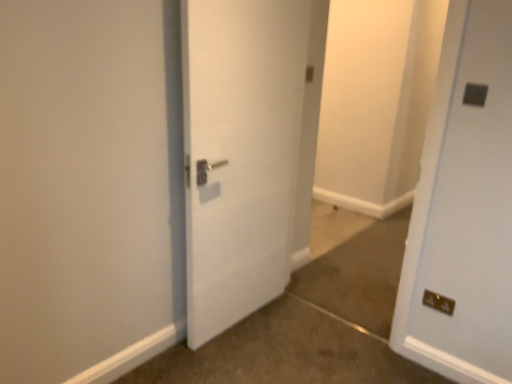
Measure the distance between point (174, 358) and camera.

Point (174, 358) and camera are 2.20 meters apart from each other.

The width and height of the screenshot is (512, 384). Find the location of `dark gray plastic electric outlet at upper right, which is the first electric outlet from top to bottom`. dark gray plastic electric outlet at upper right, which is the first electric outlet from top to bottom is located at coordinates coord(475,94).

In order to face metallic gold electrical outlet at lower right, which is the 2th electric outlet in front-to-back order, should I rotate leftwards or rightwards?

Turn right approximately 23.109 degrees to face it.

What do you see at coordinates (240, 153) in the screenshot? I see `white matte door at center` at bounding box center [240, 153].

The image size is (512, 384). In order to click on brown carpet at lower right in this screenshot , I will do pyautogui.click(x=311, y=325).

Which of these two, metallic gold electrical outlet at lower right, placed as the first electric outlet when sorted from back to front, or white matte door at center, is bigger?

white matte door at center.

Identify the location of electric outlet directly beneath the white matte door at center (from a real-world perspective). (438, 302).

Considering the sizes of objects metallic gold electrical outlet at lower right, placed as the first electric outlet when sorted from back to front, and white matte door at center in the image provided, who is taller, metallic gold electrical outlet at lower right, placed as the first electric outlet when sorted from back to front, or white matte door at center?

white matte door at center.

Considering their positions, is metallic gold electrical outlet at lower right, the first electric outlet from the bottom, located in front of or behind white matte door at center?

In the image, metallic gold electrical outlet at lower right, the first electric outlet from the bottom, appears behind white matte door at center.

Does brown carpet at lower right have a smaller size compared to white matte door at center?

Indeed, brown carpet at lower right has a smaller size compared to white matte door at center.

Which is in front, point (421, 378) or point (195, 8)?

The point (195, 8) is in front.

Is brown carpet at lower right oriented away from white matte door at center?

No, white matte door at center is not at the back of brown carpet at lower right.

Does dark gray plastic electric outlet at upper right, which is the first electric outlet from top to bottom, lie in front of white matte door at center?

No, it is not.

Would you consider dark gray plastic electric outlet at upper right, the 1th electric outlet viewed from the front, to be distant from white matte door at center?

That's right, there is a large distance between dark gray plastic electric outlet at upper right, the 1th electric outlet viewed from the front, and white matte door at center.

Considering the positions of points (481, 101) and (220, 221), is point (481, 101) farther from camera compared to point (220, 221)?

No, (481, 101) is in front of (220, 221).

Could you tell me if dark gray plastic electric outlet at upper right, the 1th electric outlet viewed from the front, is facing white matte door at center?

No.

From the image's perspective, does brown carpet at lower right appear higher than metallic gold electrical outlet at lower right, which is counted as the second electric outlet, starting from the top?

Incorrect, from the image's perspective, brown carpet at lower right is lower than metallic gold electrical outlet at lower right, which is counted as the second electric outlet, starting from the top.

Is brown carpet at lower right smaller than metallic gold electrical outlet at lower right, which is counted as the second electric outlet, starting from the top?

Incorrect, brown carpet at lower right is not smaller in size than metallic gold electrical outlet at lower right, which is counted as the second electric outlet, starting from the top.

Is brown carpet at lower right aimed at metallic gold electrical outlet at lower right, which is counted as the second electric outlet, starting from the top?

No.

From the picture: Is brown carpet at lower right to the left of metallic gold electrical outlet at lower right, placed as the first electric outlet when sorted from back to front, from the viewer's perspective?

Correct, you'll find brown carpet at lower right to the left of metallic gold electrical outlet at lower right, placed as the first electric outlet when sorted from back to front.

Is brown carpet at lower right completely or partially inside white matte door at center?

No, brown carpet at lower right is located outside of white matte door at center.

Is white matte door at center positioned far away from brown carpet at lower right?

No, white matte door at center is not far away from brown carpet at lower right.

Considering the sizes of objects white matte door at center and brown carpet at lower right in the image provided, who is thinner, white matte door at center or brown carpet at lower right?

Thinner between the two is white matte door at center.

Could you tell me if white matte door at center is facing brown carpet at lower right?

Yes, white matte door at center is facing brown carpet at lower right.

Is dark gray plastic electric outlet at upper right, which is the first electric outlet from top to bottom, directly adjacent to brown carpet at lower right?

They are not placed beside each other.

Which of these two, dark gray plastic electric outlet at upper right, which appears as the 2th electric outlet when ordered from the bottom, or brown carpet at lower right, stands taller?

dark gray plastic electric outlet at upper right, which appears as the 2th electric outlet when ordered from the bottom, is taller.

Is dark gray plastic electric outlet at upper right, the 1th electric outlet viewed from the front, positioned with its back to brown carpet at lower right?

That's not correct — dark gray plastic electric outlet at upper right, the 1th electric outlet viewed from the front, is not looking away from brown carpet at lower right.

Is point (469, 99) positioned after point (395, 233)?

No, it is not.

From the image's perspective, is metallic gold electrical outlet at lower right, the first electric outlet from the bottom, located above brown carpet at lower right?

Yes, from the image's perspective, metallic gold electrical outlet at lower right, the first electric outlet from the bottom, is on top of brown carpet at lower right.

From a real-world perspective, between metallic gold electrical outlet at lower right, the first electric outlet from the bottom, and brown carpet at lower right, who is vertically higher?

metallic gold electrical outlet at lower right, the first electric outlet from the bottom, from a real-world perspective.

Is there a large distance between metallic gold electrical outlet at lower right, the first electric outlet from the bottom, and brown carpet at lower right?

No, there isn't a large distance between metallic gold electrical outlet at lower right, the first electric outlet from the bottom, and brown carpet at lower right.

This screenshot has height=384, width=512. What are the coordinates of `electric outlet below the white matte door at center (from the image's perspective)` in the screenshot? It's located at (438, 302).

Where is `concrete in front of the white matte door at center`? concrete in front of the white matte door at center is located at coordinates (311, 325).

Based on their spatial positions, is white matte door at center or brown carpet at lower right closer to metallic gold electrical outlet at lower right, the first electric outlet from the bottom?

brown carpet at lower right.

Which object lies further to the anchor point metallic gold electrical outlet at lower right, which is the 2th electric outlet in front-to-back order, brown carpet at lower right or dark gray plastic electric outlet at upper right, which is the first electric outlet from top to bottom?

dark gray plastic electric outlet at upper right, which is the first electric outlet from top to bottom, lies further to metallic gold electrical outlet at lower right, which is the 2th electric outlet in front-to-back order, than the other object.

In the scene shown: Considering their positions, is dark gray plastic electric outlet at upper right, which is the first electric outlet from top to bottom, positioned further to metallic gold electrical outlet at lower right, placed as the first electric outlet when sorted from back to front, than brown carpet at lower right?

dark gray plastic electric outlet at upper right, which is the first electric outlet from top to bottom.

Estimate the real-world distances between objects in this image. Which object is closer to metallic gold electrical outlet at lower right, placed as the first electric outlet when sorted from back to front, brown carpet at lower right or white matte door at center?

Based on the image, brown carpet at lower right appears to be nearer to metallic gold electrical outlet at lower right, placed as the first electric outlet when sorted from back to front.

Looking at the image, which one is located further to white matte door at center, metallic gold electrical outlet at lower right, which is counted as the second electric outlet, starting from the top, or dark gray plastic electric outlet at upper right, which appears as the 2th electric outlet when ordered from the bottom?

The object further to white matte door at center is metallic gold electrical outlet at lower right, which is counted as the second electric outlet, starting from the top.

Estimate the real-world distances between objects in this image. Which object is closer to white matte door at center, metallic gold electrical outlet at lower right, the first electric outlet from the bottom, or brown carpet at lower right?

Among the two, brown carpet at lower right is located nearer to white matte door at center.

From the image, which object appears to be nearer to brown carpet at lower right, dark gray plastic electric outlet at upper right, the 1th electric outlet viewed from the front, or white matte door at center?

white matte door at center.

Which object lies nearer to the anchor point dark gray plastic electric outlet at upper right, which is the first electric outlet from top to bottom, brown carpet at lower right or metallic gold electrical outlet at lower right, which is the 2th electric outlet in front-to-back order?

metallic gold electrical outlet at lower right, which is the 2th electric outlet in front-to-back order, is closer to dark gray plastic electric outlet at upper right, which is the first electric outlet from top to bottom.

Where is `door between dark gray plastic electric outlet at upper right, placed as the 2th electric outlet when sorted from back to front, and brown carpet at lower right from top to bottom`? This screenshot has width=512, height=384. door between dark gray plastic electric outlet at upper right, placed as the 2th electric outlet when sorted from back to front, and brown carpet at lower right from top to bottom is located at coordinates (240, 153).

Find the location of a particular element. This screenshot has height=384, width=512. electric outlet between dark gray plastic electric outlet at upper right, which appears as the 2th electric outlet when ordered from the bottom, and brown carpet at lower right, in the vertical direction is located at coordinates (438, 302).

Locate an element on the screen. Image resolution: width=512 pixels, height=384 pixels. electric outlet between white matte door at center and brown carpet at lower right in the vertical direction is located at coordinates (438, 302).

Find the location of `electric outlet located between white matte door at center and dark gray plastic electric outlet at upper right, placed as the 2th electric outlet when sorted from back to front, in the left-right direction`. electric outlet located between white matte door at center and dark gray plastic electric outlet at upper right, placed as the 2th electric outlet when sorted from back to front, in the left-right direction is located at coordinates (438, 302).